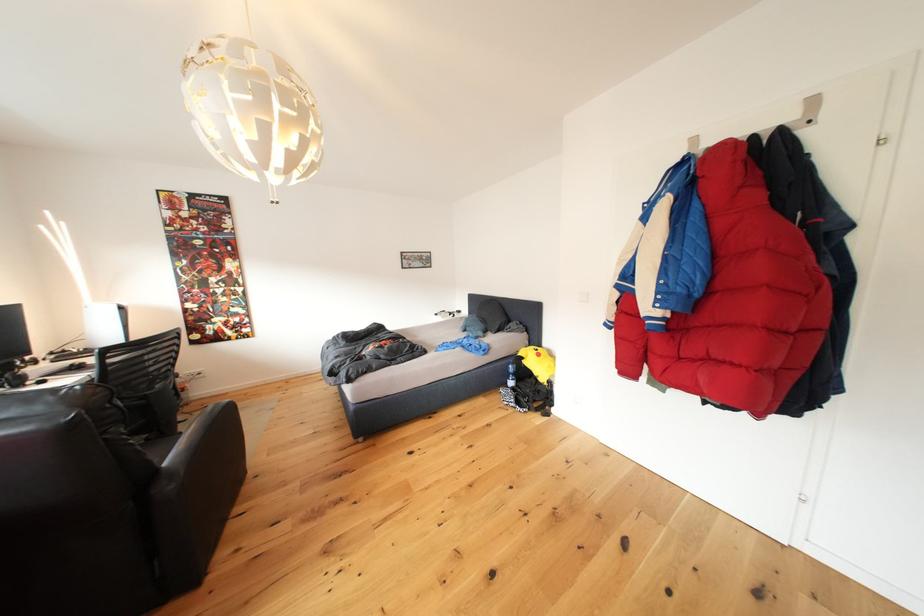
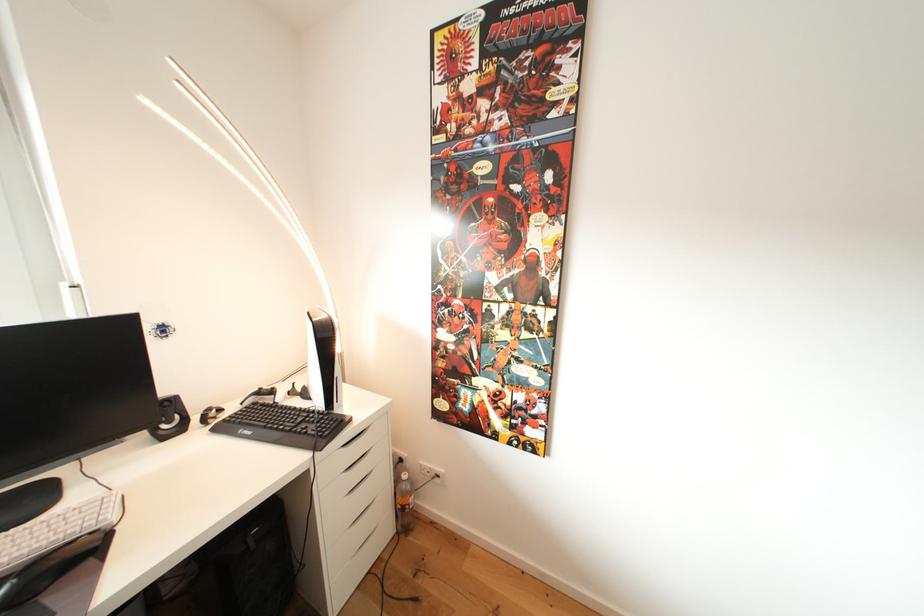
Where in the second image is the point corresponding to (x=61, y=359) from the first image?

(268, 398)